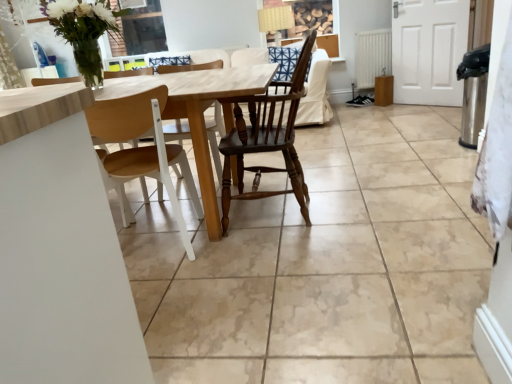
Question: Are dark wood chair at center, positioned as the 1th chair in right-to-left order, and light wood table at center far apart?

Choices:
 (A) no
 (B) yes

Answer: (A)

Question: Does dark wood chair at center, placed as the second chair when sorted from left to right, have a greater width compared to light wood table at center?

Choices:
 (A) no
 (B) yes

Answer: (A)

Question: Is the position of dark wood chair at center, positioned as the 1th chair in right-to-left order, less distant than that of light wood table at center?

Choices:
 (A) yes
 (B) no

Answer: (B)

Question: Is dark wood chair at center, placed as the second chair when sorted from left to right, touching light wood table at center?

Choices:
 (A) yes
 (B) no

Answer: (B)

Question: Would you say dark wood chair at center, placed as the second chair when sorted from left to right, is outside light wood table at center?

Choices:
 (A) yes
 (B) no

Answer: (B)

Question: From a real-world perspective, relative to dark wood chair at center, positioned as the 1th chair in right-to-left order, is satin white towel at right vertically above or below?

Choices:
 (A) above
 (B) below

Answer: (A)

Question: Is satin white towel at right inside the boundaries of dark wood chair at center, placed as the second chair when sorted from left to right, or outside?

Choices:
 (A) inside
 (B) outside

Answer: (B)

Question: Considering their positions, is satin white towel at right located in front of or behind dark wood chair at center, placed as the second chair when sorted from left to right?

Choices:
 (A) front
 (B) behind

Answer: (A)

Question: Looking at the image, does satin white towel at right seem bigger or smaller compared to dark wood chair at center, positioned as the 1th chair in right-to-left order?

Choices:
 (A) big
 (B) small

Answer: (B)

Question: Is point (367, 89) positioned closer to the camera than point (286, 147)?

Choices:
 (A) closer
 (B) farther

Answer: (B)

Question: From the image's perspective, is white matte radiator at right above or below dark wood chair at center, positioned as the 1th chair in right-to-left order?

Choices:
 (A) above
 (B) below

Answer: (A)

Question: From a real-world perspective, is white matte radiator at right above or below dark wood chair at center, positioned as the 1th chair in right-to-left order?

Choices:
 (A) below
 (B) above

Answer: (A)

Question: Considering the relative positions of white matte radiator at right and dark wood chair at center, placed as the second chair when sorted from left to right, in the image provided, is white matte radiator at right to the left or to the right of dark wood chair at center, placed as the second chair when sorted from left to right,?

Choices:
 (A) left
 (B) right

Answer: (B)

Question: From the image's perspective, is white matte radiator at right located above or below satin white towel at right?

Choices:
 (A) below
 (B) above

Answer: (B)

Question: From a real-world perspective, is white matte radiator at right physically located above or below satin white towel at right?

Choices:
 (A) above
 (B) below

Answer: (B)